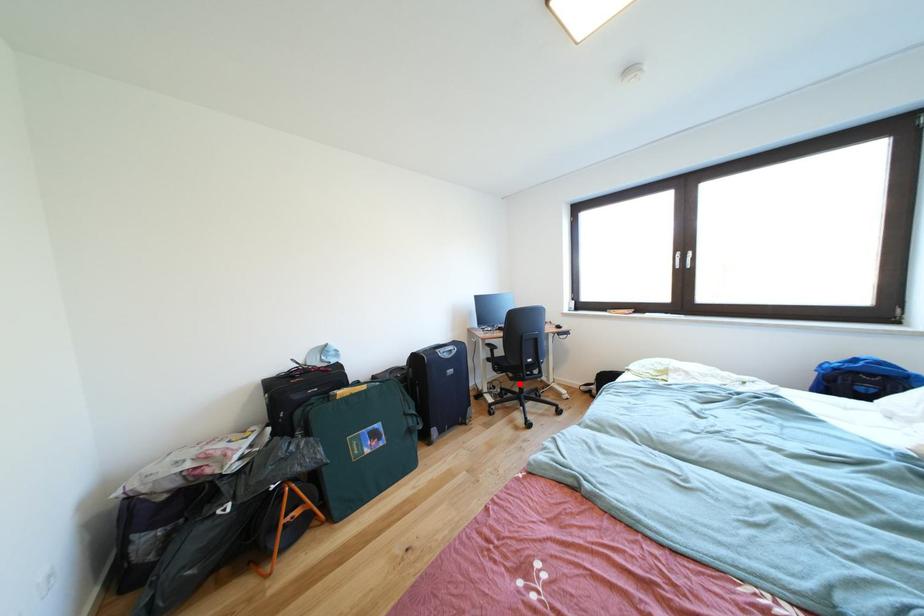
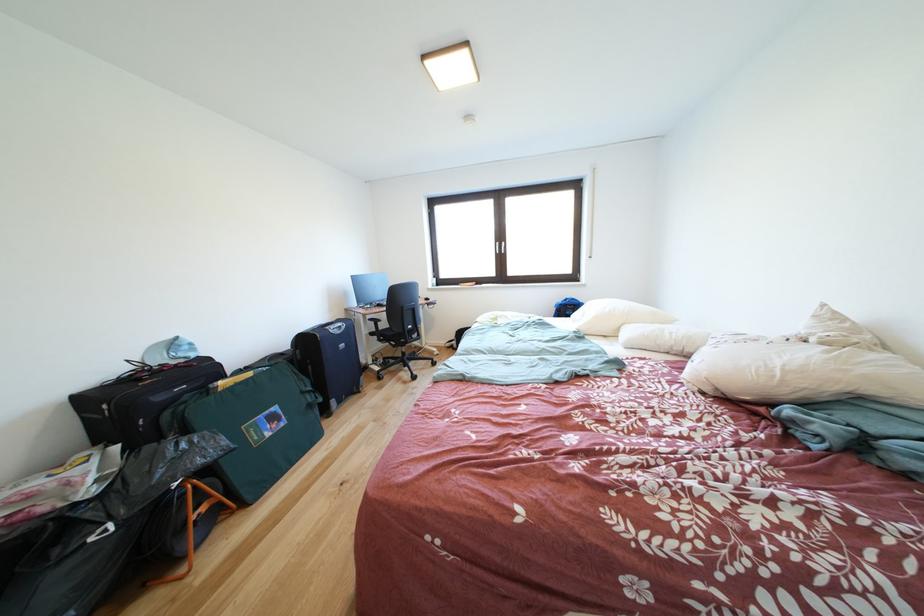
Question: I am providing you with two images of the same scene from different viewpoints. Given a red point in image1, look at the same physical point in image2. Is it:

Choices:
 (A) Closer to the viewpoint
 (B) Farther from the viewpoint

Answer: (A)